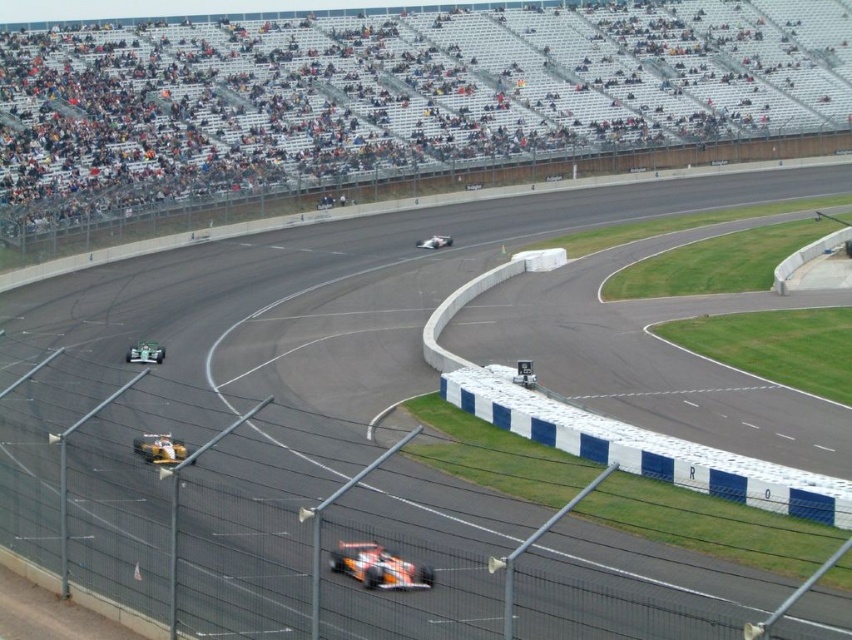
You are a race commentator watching the Formula One race. You see the orange metallic race car at lower center and the orange metallic race car at lower left. Which car is currently leading the race?

The orange metallic race car at lower center is leading the race because it is positioned in front of the orange metallic race car at lower left.

You are a race engineer observing the Formula One race. You notice the orange metallic race car at lower center is at point [378,566]. The race track has a maximum speed limit of 300 kmph. Can the car maintain this speed at this point?

The orange metallic race car at lower center is at point [378,566]. Since the race track has a maximum speed limit of 300 kmph, the car can maintain this speed at this point as long as it adheres to the track regulations and conditions.